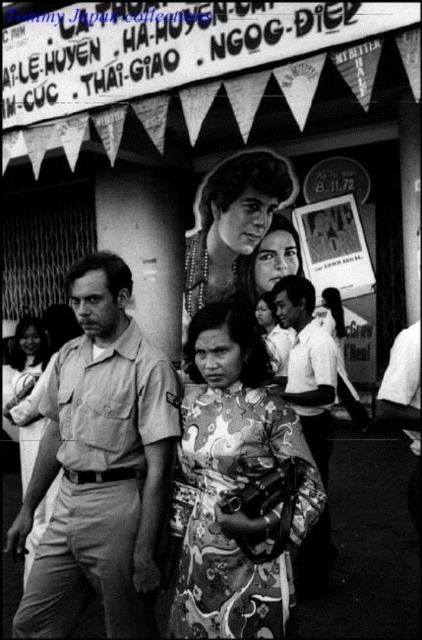
Question: Which object is the farthest from the floral dress at center?

Choices:
 (A) printed paper poster at center
 (B) floral silk dress at center
 (C) floral fabric dress at lower center
 (D) light beige uniform at center

Answer: (B)

Question: Estimate the real-world distances between objects in this image. Which object is closer to the floral dress at center?

Choices:
 (A) light beige uniform at center
 (B) printed paper poster at center
 (C) floral silk dress at center

Answer: (B)

Question: Is light beige uniform at center in front of floral silk dress at center?

Choices:
 (A) yes
 (B) no

Answer: (B)

Question: Which point is closer to the camera?

Choices:
 (A) (241, 221)
 (B) (362, 289)
 (C) (10, 548)

Answer: (C)

Question: Does floral silk dress at center appear over floral fabric dress at lower center?

Choices:
 (A) yes
 (B) no

Answer: (B)

Question: Does floral dress at center lie behind printed paper poster at center?

Choices:
 (A) no
 (B) yes

Answer: (B)